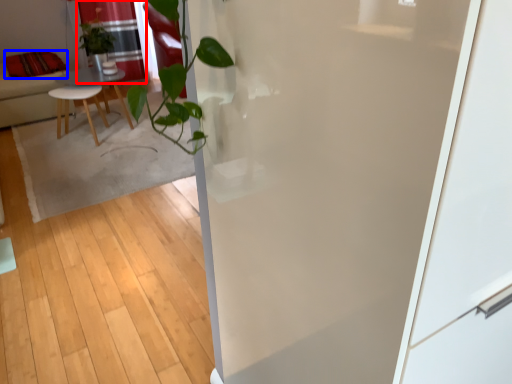
Question: Among these objects, which one is nearest to the camera, curtain (highlighted by a red box) or pillow (highlighted by a blue box)?

Choices:
 (A) curtain
 (B) pillow

Answer: (B)